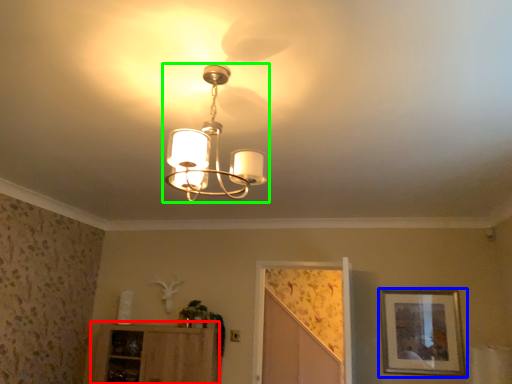
Question: Which object is positioned farthest from cabinetry (highlighted by a red box)? Select from picture frame (highlighted by a blue box) and lamp (highlighted by a green box).

Choices:
 (A) picture frame
 (B) lamp

Answer: (B)